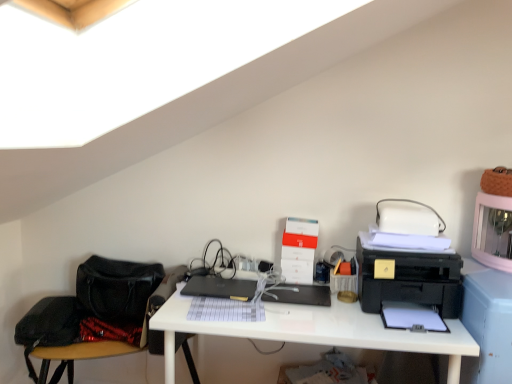
Question: Is the position of black plastic register at center less distant than that of white glossy desk at center?

Choices:
 (A) no
 (B) yes

Answer: (A)

Question: From a real-world perspective, is black plastic register at center located beneath white glossy desk at center?

Choices:
 (A) yes
 (B) no

Answer: (B)

Question: Considering the relative sizes of black plastic register at center and white glossy desk at center in the image provided, is black plastic register at center taller than white glossy desk at center?

Choices:
 (A) yes
 (B) no

Answer: (B)

Question: Would you say black plastic register at center is outside white glossy desk at center?

Choices:
 (A) no
 (B) yes

Answer: (A)

Question: Is black plastic register at center wider than white glossy desk at center?

Choices:
 (A) no
 (B) yes

Answer: (A)

Question: Considering the positions of white cardboard box at center and black matte laptop at center in the image, is white cardboard box at center taller or shorter than black matte laptop at center?

Choices:
 (A) tall
 (B) short

Answer: (A)

Question: Relative to black matte laptop at center, is white cardboard box at center in front or behind?

Choices:
 (A) behind
 (B) front

Answer: (A)

Question: Considering the positions of point (305, 231) and point (201, 276), is point (305, 231) closer or farther from the camera than point (201, 276)?

Choices:
 (A) closer
 (B) farther

Answer: (A)

Question: Choose the correct answer: Is white cardboard box at center inside black matte laptop at center or outside it?

Choices:
 (A) inside
 (B) outside

Answer: (B)

Question: From the image's perspective, is white cardboard box at center above or below black plastic printer at right?

Choices:
 (A) below
 (B) above

Answer: (B)

Question: Is point (282, 264) closer or farther from the camera than point (376, 281)?

Choices:
 (A) farther
 (B) closer

Answer: (A)

Question: In the image, is white cardboard box at center on the left side or the right side of black plastic printer at right?

Choices:
 (A) right
 (B) left

Answer: (B)

Question: Is white cardboard box at center bigger or smaller than black plastic printer at right?

Choices:
 (A) small
 (B) big

Answer: (A)

Question: Visually, is black matte laptop at center positioned to the left or to the right of black plastic printer at right?

Choices:
 (A) right
 (B) left

Answer: (B)

Question: Is black matte laptop at center taller or shorter than black plastic printer at right?

Choices:
 (A) short
 (B) tall

Answer: (A)